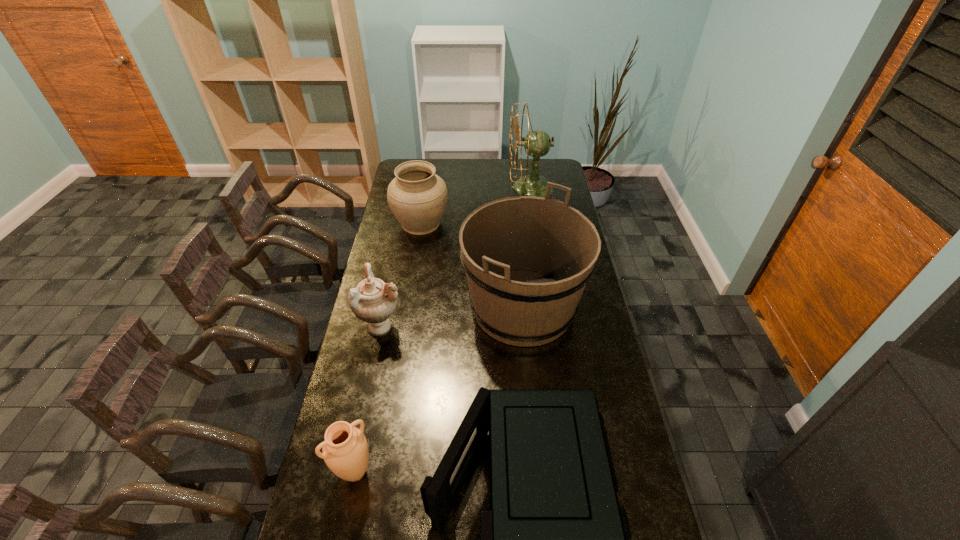
Locate an element on the screen. This screenshot has height=540, width=960. vacant space that is in between the farthest urn and the second farthest urn is located at coordinates (401, 274).

You are a GUI agent. You are given a task and a screenshot of the screen. Output one action in this format:
    pyautogui.click(x=<x>, y=<y>)
    Task: Click on the object that ranks as the fourth closest to the second farthest urn
    The width and height of the screenshot is (960, 540).
    Given the screenshot: What is the action you would take?
    pyautogui.click(x=417, y=197)

Identify which object is the closest to the second nearest urn. Please provide its 2D coordinates. Your answer should be formatted as a tuple, i.e. [(x, y)], where the tuple contains the x and y coordinates of a point satisfying the conditions above.

[(527, 259)]

The width and height of the screenshot is (960, 540). Find the location of `urn identified as the closest to the farthest urn`. urn identified as the closest to the farthest urn is located at coordinates (373, 301).

Identify which urn is located as the third nearest to the microwave oven. Please provide its 2D coordinates. Your answer should be formatted as a tuple, i.e. [(x, y)], where the tuple contains the x and y coordinates of a point satisfying the conditions above.

[(417, 197)]

At what (x,y) coordinates should I click in order to perform the action: click on free space that satisfies the following two spatial constraints: 1. in front of the fan, directing air flow; 2. on the front side of the nearest urn. Please return your answer as a coordinate pair (x, y). This screenshot has width=960, height=540. Looking at the image, I should click on (574, 472).